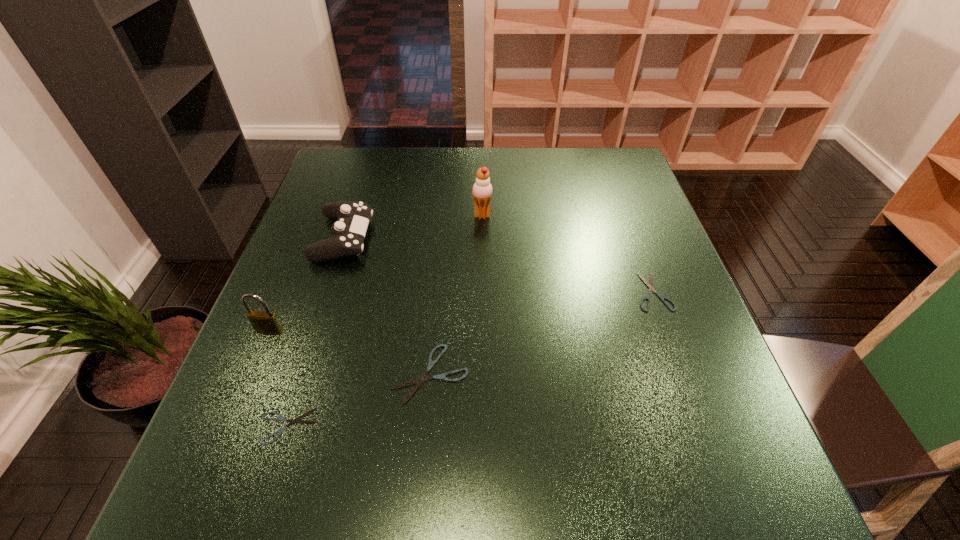
To make them evenly spaced by inserting another shears among them, please locate a vacant spot for this new shears. Please provide its 2D coordinates. Your answer should be formatted as a tuple, i.e. [(x, y)], where the tuple contains the x and y coordinates of a point satisfying the conditions above.

[(550, 330)]